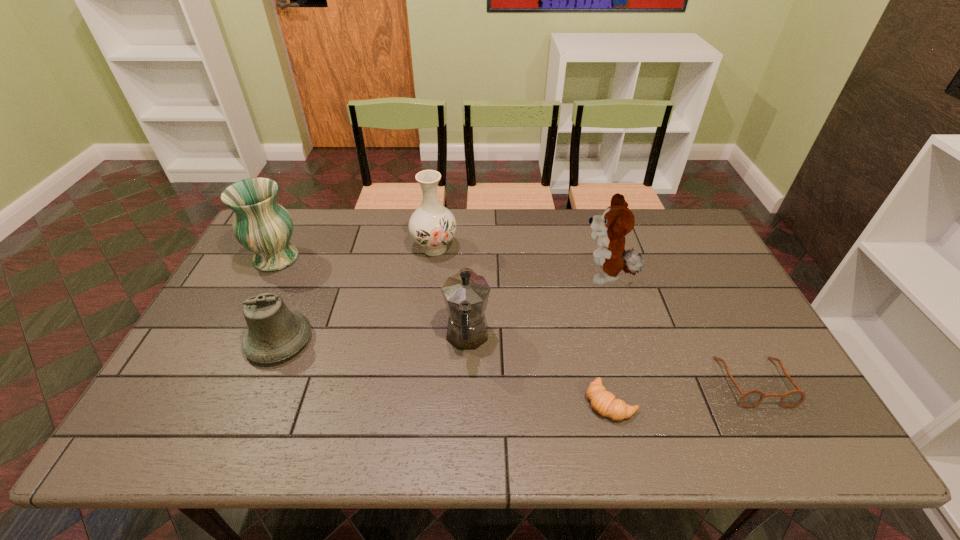
The height and width of the screenshot is (540, 960). What are the coordinates of `bell positioned at the left edge` in the screenshot? It's located at (274, 333).

You are a GUI agent. You are given a task and a screenshot of the screen. Output one action in this format:
    pyautogui.click(x=<x>, y=<y>)
    Task: Click on the object that is at the right edge
    Image resolution: width=960 pixels, height=540 pixels.
    Given the screenshot: What is the action you would take?
    pyautogui.click(x=751, y=398)

You are a GUI agent. You are given a task and a screenshot of the screen. Output one action in this format:
    pyautogui.click(x=<x>, y=<y>)
    Task: Click on the object that is at the far left corner
    This screenshot has height=540, width=960.
    Given the screenshot: What is the action you would take?
    pyautogui.click(x=261, y=225)

This screenshot has height=540, width=960. I want to click on vacant space at the far edge, so click(x=601, y=209).

Image resolution: width=960 pixels, height=540 pixels. I want to click on free space at the near edge of the desktop, so click(334, 436).

I want to click on vacant space at the left edge of the desktop, so click(204, 362).

Where is `vacant space at the right edge of the desktop`? This screenshot has height=540, width=960. vacant space at the right edge of the desktop is located at coordinates (725, 371).

At what (x,y) coordinates should I click in order to perform the action: click on free space at the far right corner of the desktop. Please return your answer as a coordinate pair (x, y). The image size is (960, 540). Looking at the image, I should click on (681, 235).

Where is `free space that is in between the right vase and the puppy`? free space that is in between the right vase and the puppy is located at coordinates (520, 262).

I want to click on free area in between the crescent roll and the right vase, so click(x=522, y=325).